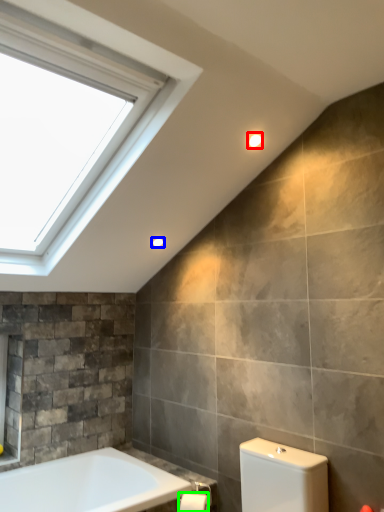
Question: Considering the real-world distances, which object is closest to light fixture (highlighted by a red box)? light fixture (highlighted by a blue box) or toilet paper (highlighted by a green box).

Choices:
 (A) light fixture
 (B) toilet paper

Answer: (A)